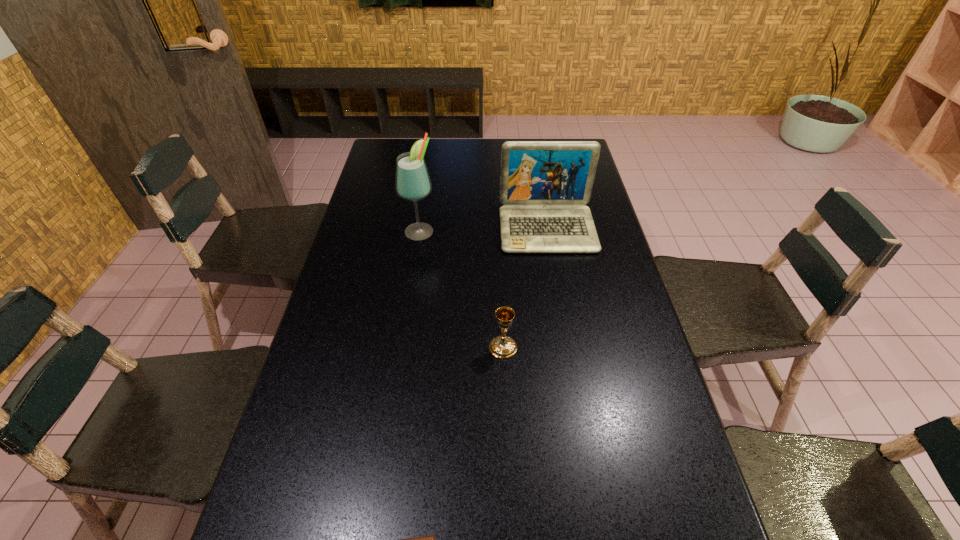
Where is `empty location between the third farthest object and the third shortest object`? Image resolution: width=960 pixels, height=540 pixels. empty location between the third farthest object and the third shortest object is located at coordinates (525, 288).

Locate an element on the screen. free space between the second tallest object and the chalice is located at coordinates (525, 288).

Identify the location of free space between the chalice and the third shortest object. (525, 288).

The height and width of the screenshot is (540, 960). Find the location of `object that stands as the third closest to the chalice`. object that stands as the third closest to the chalice is located at coordinates (412, 182).

Image resolution: width=960 pixels, height=540 pixels. Identify the location of object that is the second closest one to the chocolate bar. (544, 185).